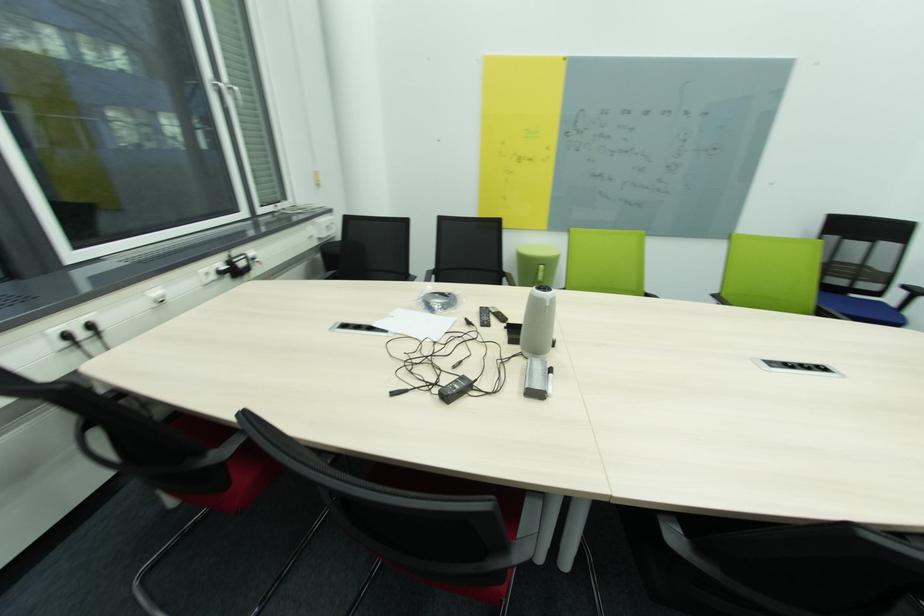
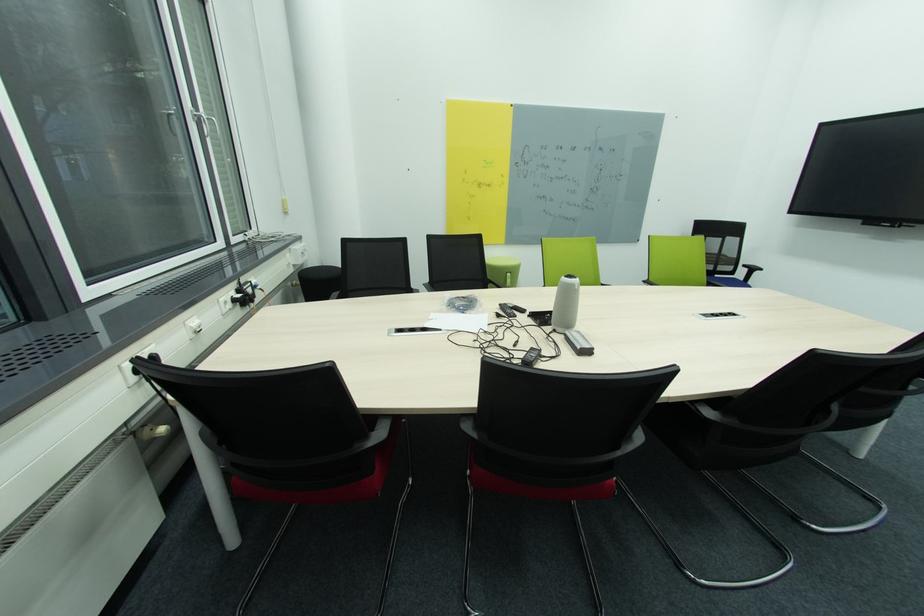
Where in the second image is the point corresponding to pixel 545 268 from the first image?

(514, 276)